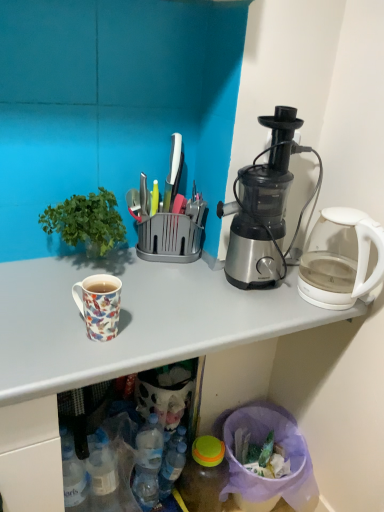
Identify the location of vacant area in front of satin silver blender at right. (243, 314).